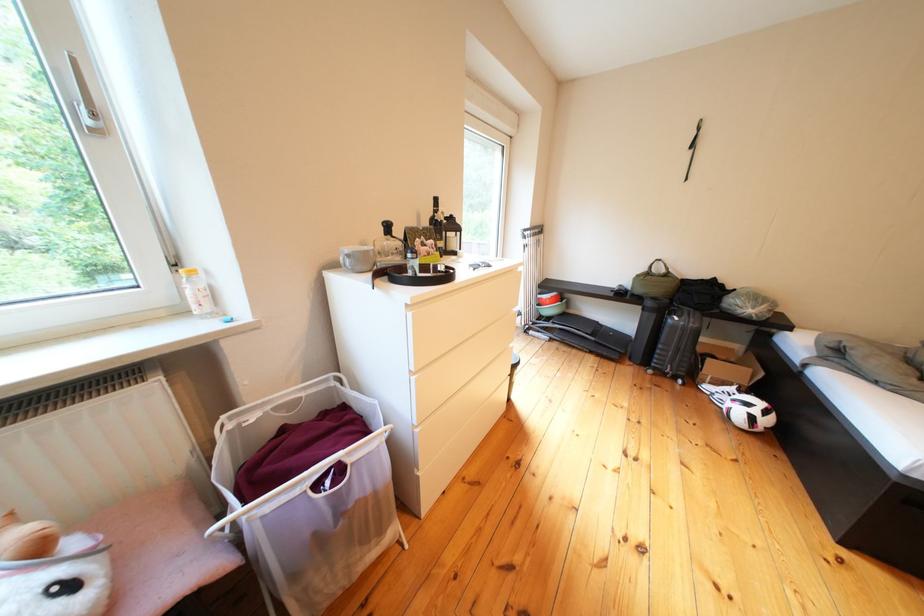
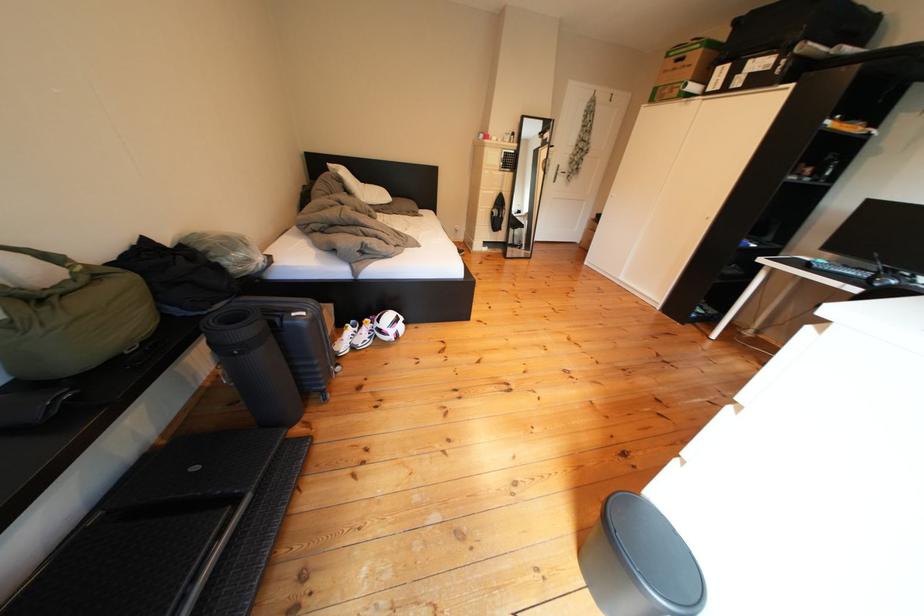
Locate, in the second image, the point that corresponds to point (689, 323) in the first image.

(317, 318)